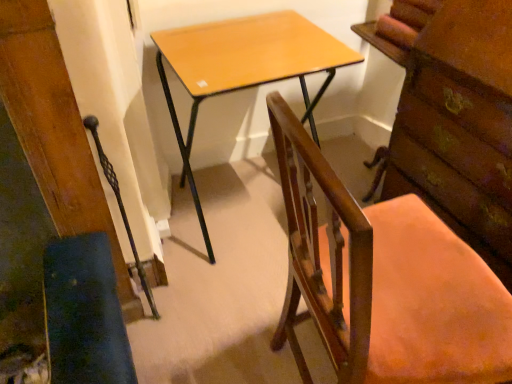
At what (x,y) coordinates should I click in order to perform the action: click on vacant space positioned to the left of wooden chair at center. Please return your answer as a coordinate pair (x, y). This screenshot has width=512, height=384. Looking at the image, I should click on (210, 326).